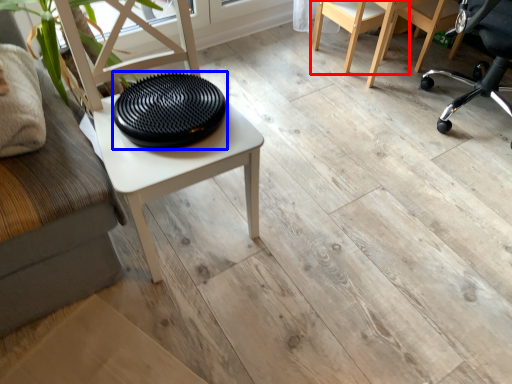
Question: Among these objects, which one is farthest to the camera, chair (highlighted by a red box) or tray (highlighted by a blue box)?

Choices:
 (A) chair
 (B) tray

Answer: (A)